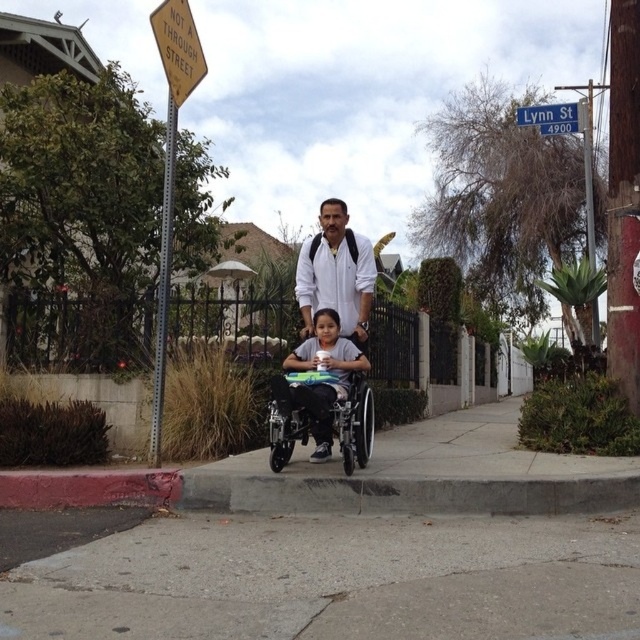
Question: Can you confirm if white matte shirt at center is wider than matte plastic wheelchair at center?

Choices:
 (A) no
 (B) yes

Answer: (A)

Question: Can you confirm if white matte shirt at center is thinner than matte plastic wheelchair at center?

Choices:
 (A) no
 (B) yes

Answer: (B)

Question: Is the position of white matte shirt at center more distant than that of blue plastic street sign at upper center?

Choices:
 (A) no
 (B) yes

Answer: (A)

Question: Which object appears farthest from the camera in this image?

Choices:
 (A) matte plastic wheelchair at center
 (B) white matte shirt at center
 (C) gray concrete sidewalk at lower center
 (D) blue plastic street sign at upper center

Answer: (D)

Question: Which object is closer to the camera taking this photo?

Choices:
 (A) matte plastic wheelchair at center
 (B) gray concrete sidewalk at lower center
 (C) blue plastic street sign at upper center

Answer: (B)

Question: Which point appears closest to the camera in this image?

Choices:
 (A) (531, 113)
 (B) (358, 305)

Answer: (B)